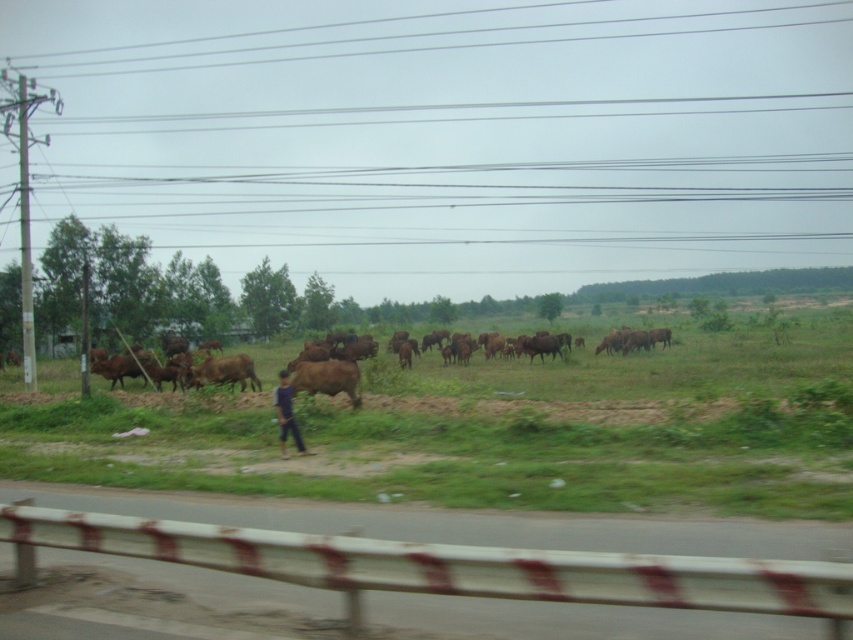
Is green grass at center closer to the viewer compared to metallic gray guardrail at lower center?

Yes, green grass at center is closer to the viewer.

Which of these two, green grass at center or metallic gray guardrail at lower center, stands shorter?

metallic gray guardrail at lower center is shorter.

Is point (166, 403) positioned behind point (538, 534)?

Yes, point (166, 403) is farther from viewer.

Image resolution: width=853 pixels, height=640 pixels. I want to click on green grass at center, so click(x=492, y=429).

Can you confirm if metallic gray guardrail at lower center is positioned above brown matte bull at center?

Actually, metallic gray guardrail at lower center is below brown matte bull at center.

This screenshot has height=640, width=853. In order to click on metallic gray guardrail at lower center in this screenshot , I will do `click(467, 522)`.

Is point (322, 372) farther from viewer compared to point (297, 444)?

Yes.

Which is in front, point (355, 396) or point (300, 452)?

Point (300, 452) is more forward.

This screenshot has width=853, height=640. What do you see at coordinates (328, 378) in the screenshot?
I see `brown matte bull at center` at bounding box center [328, 378].

The image size is (853, 640). I want to click on brown matte bull at center, so click(328, 378).